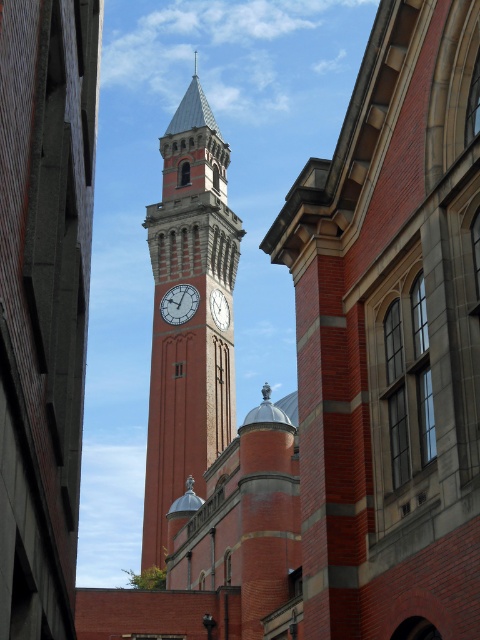
Question: Considering the real-world distances, which object is farthest from the red brick clock tower at center?

Choices:
 (A) matte brick clock at center
 (B) white clock face at center

Answer: (A)

Question: Which point is farther to the camera?

Choices:
 (A) (164, 294)
 (B) (189, 106)

Answer: (B)

Question: Considering the real-world distances, which object is farthest from the red brick clock tower at center?

Choices:
 (A) matte brick clock at center
 (B) white clock face at center

Answer: (A)

Question: Does red brick clock tower at center lie in front of matte brick clock at center?

Choices:
 (A) no
 (B) yes

Answer: (B)

Question: Can you confirm if red brick clock tower at center is positioned below matte brick clock at center?

Choices:
 (A) no
 (B) yes

Answer: (A)

Question: Considering the relative positions of matte brick clock at center and white clock face at center in the image provided, where is matte brick clock at center located with respect to white clock face at center?

Choices:
 (A) left
 (B) right

Answer: (A)